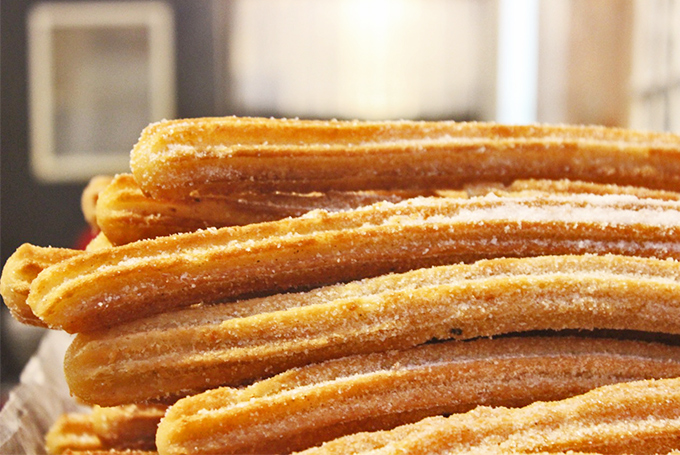
Locate an element on the screen. partial room divider is located at coordinates (515, 67).